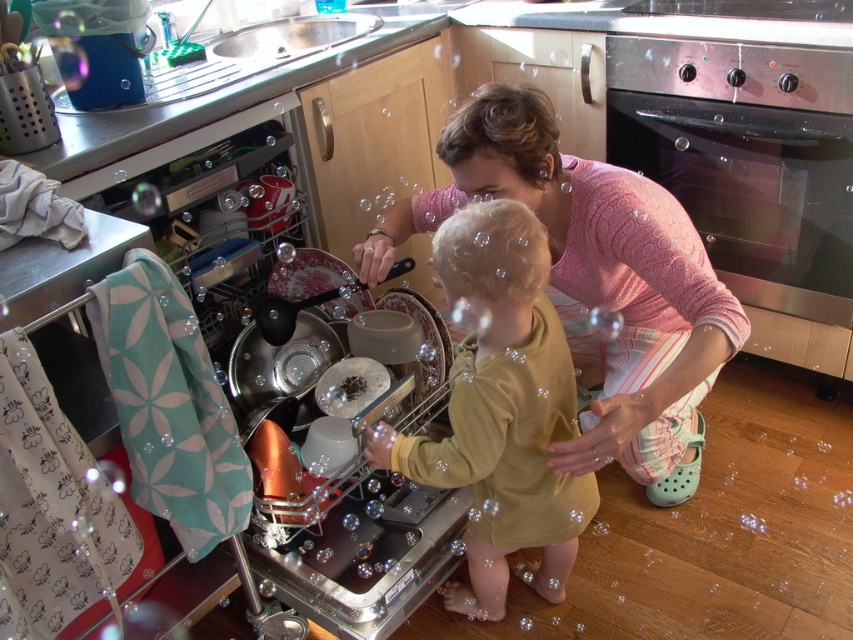
Does stainless steel oven at lower right lie behind metallic silver dish washer at left?

Yes, it is behind metallic silver dish washer at left.

Does point (798, 236) come in front of point (62, 305)?

No.

Is point (828, 176) closer to camera compared to point (305, 288)?

Yes, point (828, 176) is in front of point (305, 288).

The height and width of the screenshot is (640, 853). In order to click on stainless steel oven at lower right in this screenshot , I will do `click(752, 168)`.

How distant is pink textured sweater at center from matte yellow shirt at center?

pink textured sweater at center is 9.61 inches from matte yellow shirt at center.

Is pink textured sweater at center to the left of matte yellow shirt at center from the viewer's perspective?

Incorrect, pink textured sweater at center is not on the left side of matte yellow shirt at center.

What do you see at coordinates (595, 284) in the screenshot? I see `pink textured sweater at center` at bounding box center [595, 284].

Where is `pink textured sweater at center`? The image size is (853, 640). pink textured sweater at center is located at coordinates (595, 284).

Is point (647, 444) positioned after point (45, 284)?

Yes, it is behind point (45, 284).

This screenshot has height=640, width=853. Describe the element at coordinates (595, 284) in the screenshot. I see `pink textured sweater at center` at that location.

Identify the location of pink textured sweater at center. This screenshot has width=853, height=640. (595, 284).